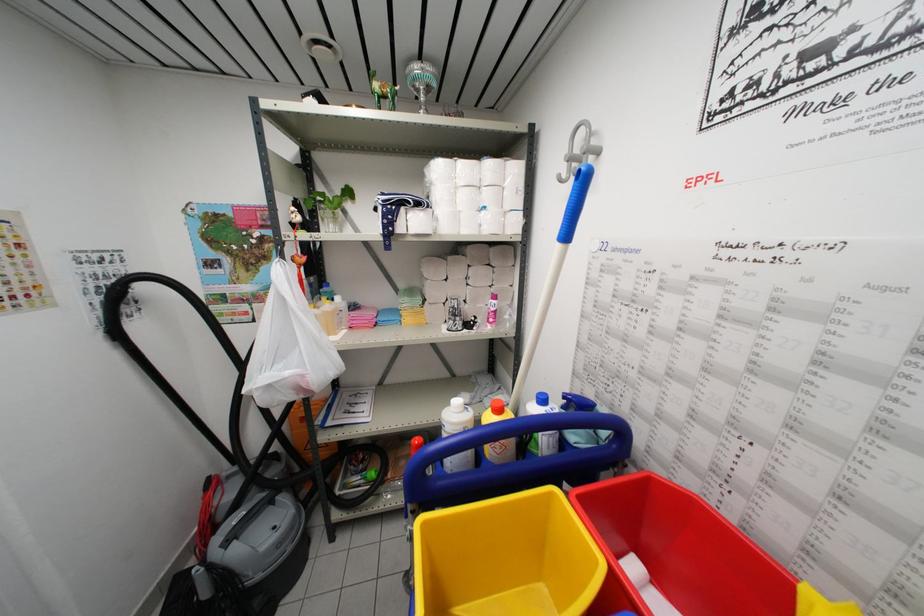
Where would you grasp the black vacuum hose? Please return your answer as a coordinate pair (x, y).

(164, 342)